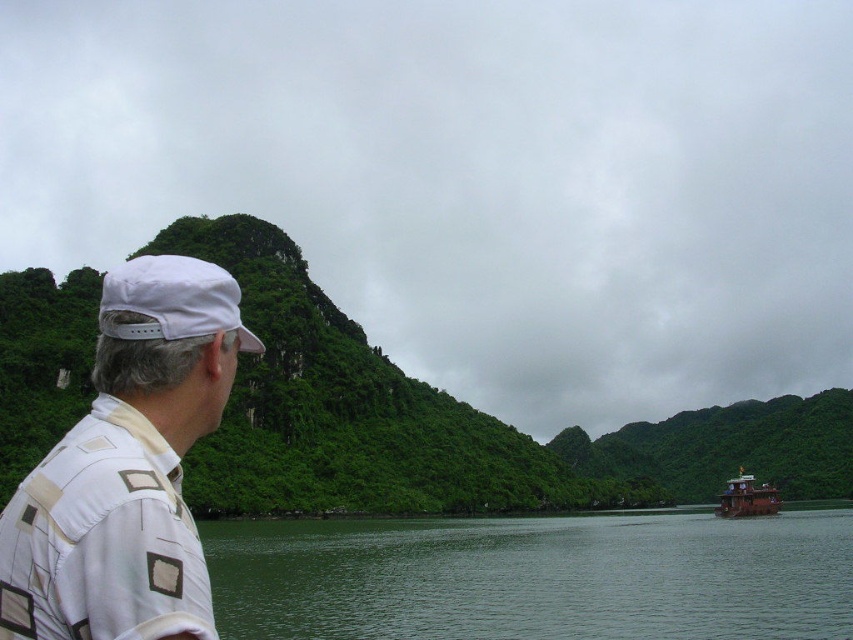
Question: Which of the following is the farthest from the observer?

Choices:
 (A) (735, 513)
 (B) (148, 289)
 (C) (19, 532)
 (D) (550, 572)

Answer: (A)

Question: Is green smooth water at lower center thinner than white fabric cap at left?

Choices:
 (A) yes
 (B) no

Answer: (B)

Question: Considering the relative positions of white fabric cap at left and brown wooden boat at right in the image provided, where is white fabric cap at left located with respect to brown wooden boat at right?

Choices:
 (A) right
 (B) left

Answer: (B)

Question: Considering the real-world distances, which object is farthest from the white fabric cap at left?

Choices:
 (A) white fabric cap at upper left
 (B) green smooth water at lower center
 (C) brown wooden boat at right

Answer: (C)

Question: Which of the following is the farthest from the observer?

Choices:
 (A) (733, 493)
 (B) (55, 476)
 (C) (569, 545)

Answer: (A)

Question: Is green smooth water at lower center below white fabric cap at upper left?

Choices:
 (A) yes
 (B) no

Answer: (A)